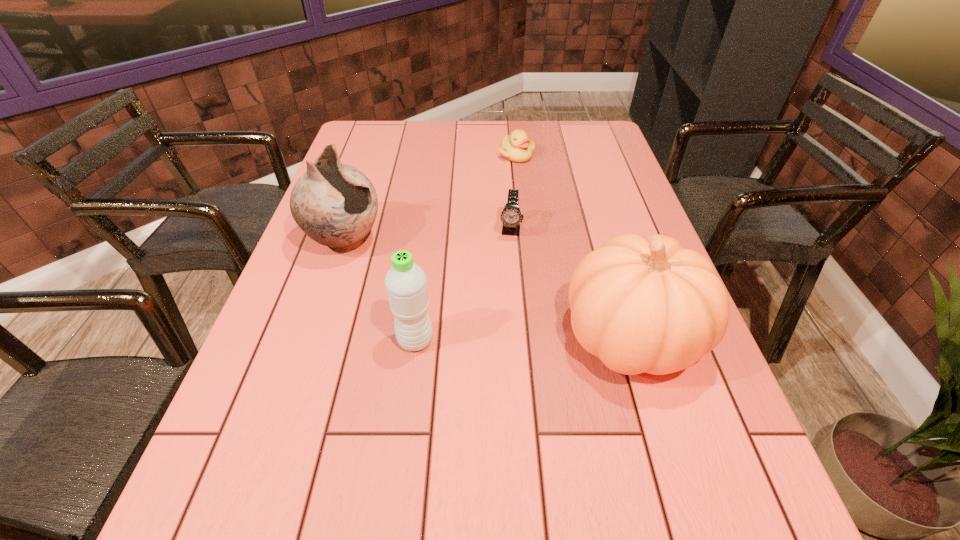
The height and width of the screenshot is (540, 960). I want to click on free spot located 0.220m on the front-facing side of the farthest object, so click(x=519, y=204).

Identify the location of free region located from the spout of the pottery. The image size is (960, 540). coord(425,285).

Locate an element on the screen. blank area located 0.320m from the spout of the pottery is located at coordinates (476, 312).

Identify the location of vacant region located 0.230m from the spout of the pottery. This screenshot has height=540, width=960. (444, 295).

At what (x,y) coordinates should I click in order to perform the action: click on vacant space located 0.350m on the face of the fourth tallest object. Please return your answer as a coordinate pair (x, y). Looking at the image, I should click on (497, 350).

You are a GUI agent. You are given a task and a screenshot of the screen. Output one action in this format:
    pyautogui.click(x=<x>, y=<y>)
    Task: Click on the free space located 0.390m on the face of the fourth tallest object
    Image resolution: width=960 pixels, height=540 pixels.
    Given the screenshot: What is the action you would take?
    pyautogui.click(x=495, y=367)

This screenshot has width=960, height=540. I want to click on vacant area located on the face of the fourth tallest object, so click(501, 314).

What are the coordinates of `object located at the far edge` in the screenshot? It's located at (518, 148).

At what (x,y) coordinates should I click in order to perform the action: click on object present at the left edge. Please return your answer as a coordinate pair (x, y). Looking at the image, I should click on (335, 204).

I want to click on object located at the right edge, so click(x=640, y=304).